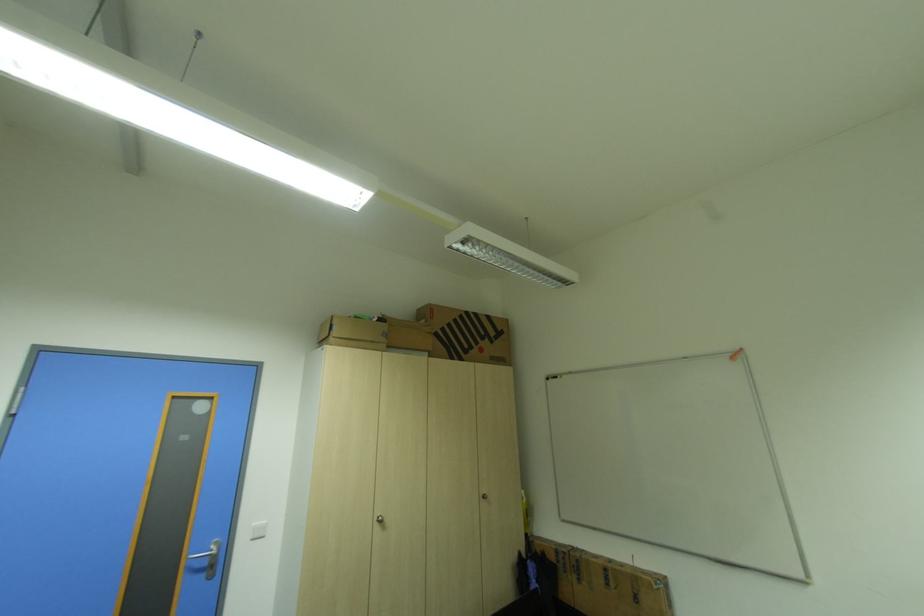
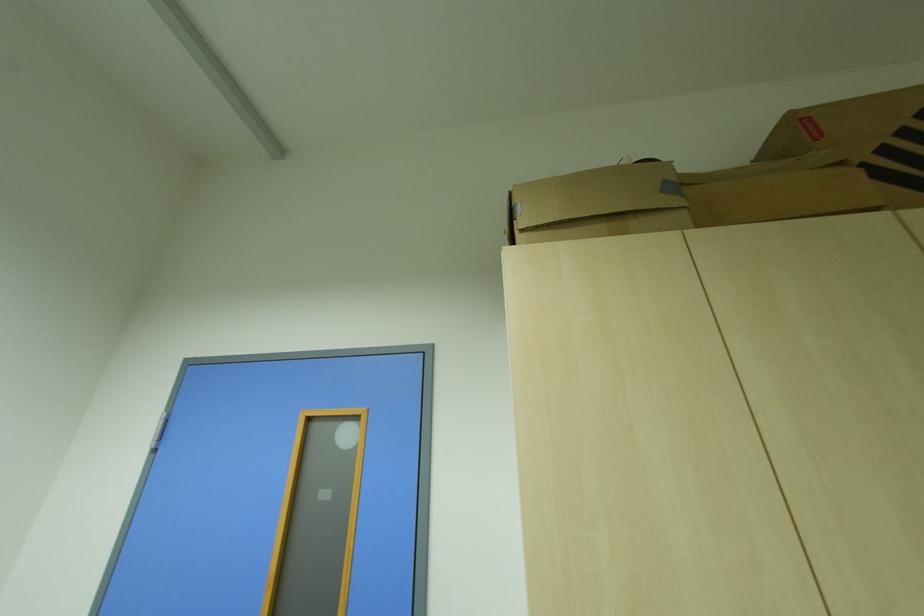
Where in the second image is the point corresponding to pixel 341 317 from the first image?

(517, 195)